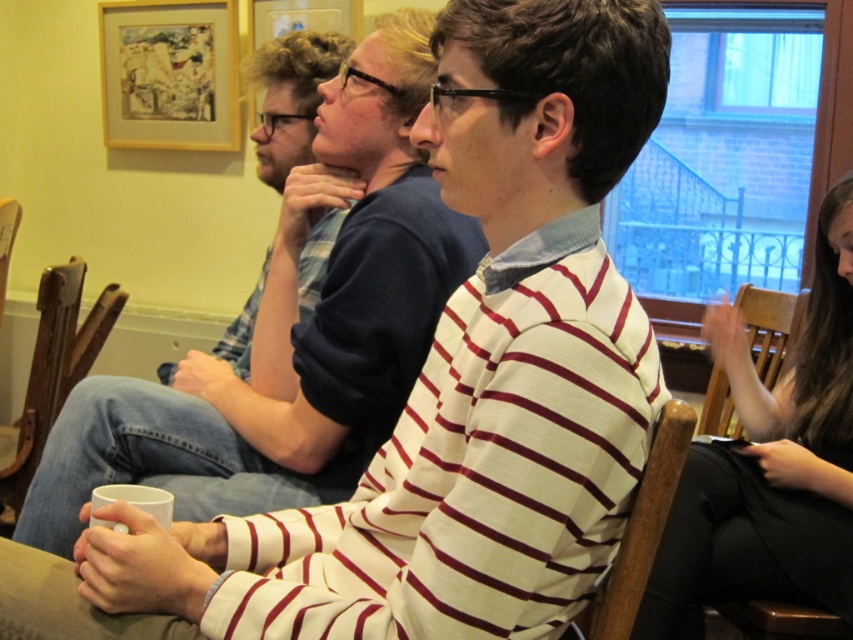
You are standing at the entrance of the room and want to sit on the brown wooden chair at lower left. Which direction should you move to reach it?

The brown wooden chair at lower left is located at point (x=55, y=365), so you should move towards the lower left direction to reach it.

From the picture: You are standing at the entrance of the room and want to sit in the wooden chair at center. Which direction should you walk to reach it?

You should walk towards the center of the room to reach the wooden chair at center, as it is located at point (641, 528).